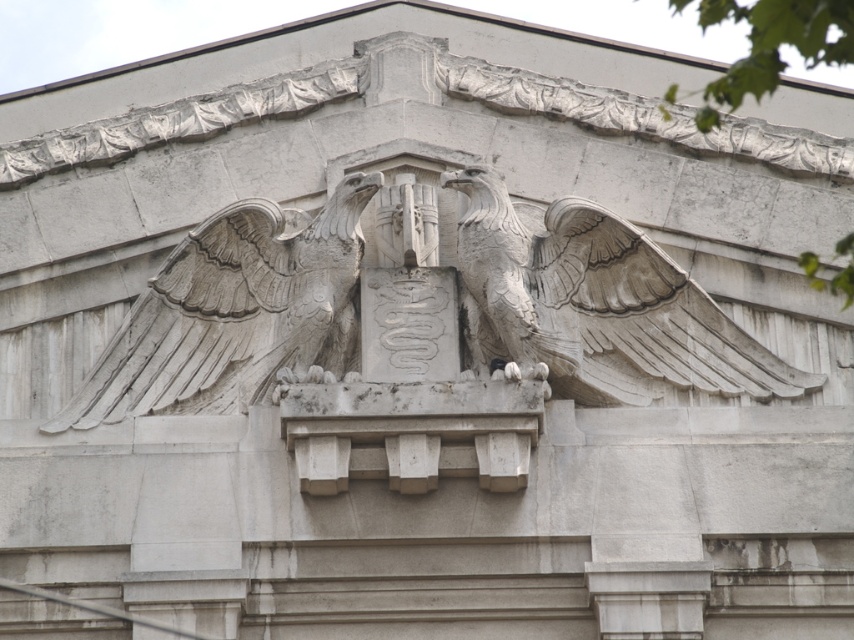
Question: Is white stone eagle at center above gray stone eagle at center?

Choices:
 (A) no
 (B) yes

Answer: (B)

Question: Does white stone eagle at center have a lesser width compared to white stone wing at upper right?

Choices:
 (A) no
 (B) yes

Answer: (A)

Question: Which of the following is the farthest from the observer?

Choices:
 (A) white stone wing at upper right
 (B) gray stone eagle at center

Answer: (B)

Question: Which object appears closest to the camera in this image?

Choices:
 (A) white stone eagle at center
 (B) white stone wing at upper right
 (C) gray stone eagle at center

Answer: (A)

Question: Based on their relative distances, which object is farther from the gray stone eagle at center?

Choices:
 (A) white stone eagle at center
 (B) white stone wing at upper right

Answer: (B)

Question: Where is white stone eagle at center located in relation to gray stone eagle at center in the image?

Choices:
 (A) below
 (B) above

Answer: (B)